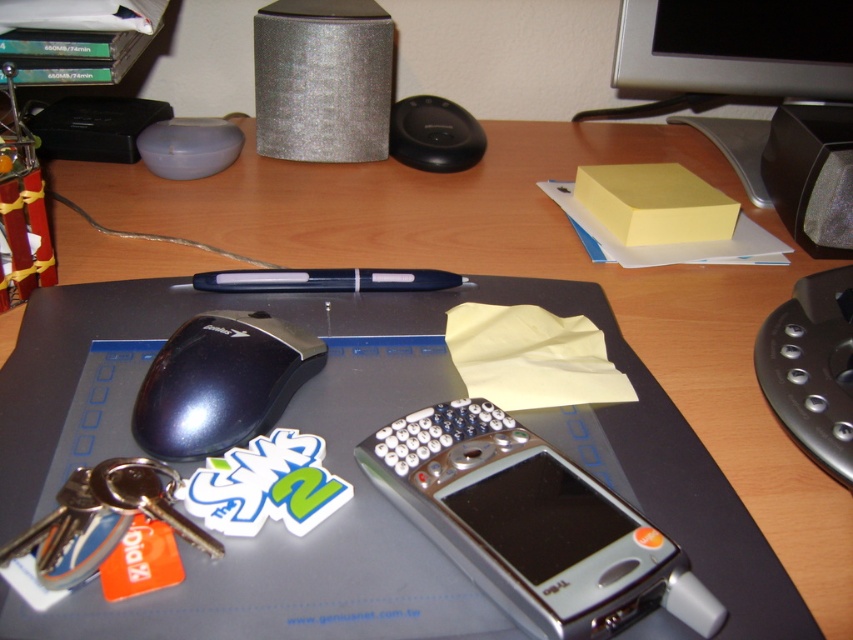
Between point (90, 499) and point (827, 125), which one is positioned in front?

Positioned in front is point (90, 499).

Is point (102, 532) farther from viewer compared to point (843, 204)?

That is False.

Which is in front, point (64, 564) or point (808, 148)?

Point (64, 564) is in front.

Identify the location of metallic keychain at lower left. (102, 518).

Is silver metallic smartphone at center taller than metallic keychain at lower left?

Indeed, silver metallic smartphone at center has a greater height compared to metallic keychain at lower left.

Is silver metallic smartphone at center to the right of metallic keychain at lower left from the viewer's perspective?

Correct, you'll find silver metallic smartphone at center to the right of metallic keychain at lower left.

Is point (474, 516) positioned in front of point (177, 518)?

Yes.

Find the location of `silver metallic smartphone at center`. silver metallic smartphone at center is located at coordinates (531, 524).

Can you confirm if silver metallic smartphone at center is bigger than silver glittery speaker at upper center?

Incorrect, silver metallic smartphone at center is not larger than silver glittery speaker at upper center.

Between point (492, 518) and point (283, 44), which one is positioned behind?

The point (283, 44) is more distant.

Where is `silver metallic smartphone at center`? The height and width of the screenshot is (640, 853). silver metallic smartphone at center is located at coordinates (531, 524).

The height and width of the screenshot is (640, 853). Identify the location of silver metallic smartphone at center. (531, 524).